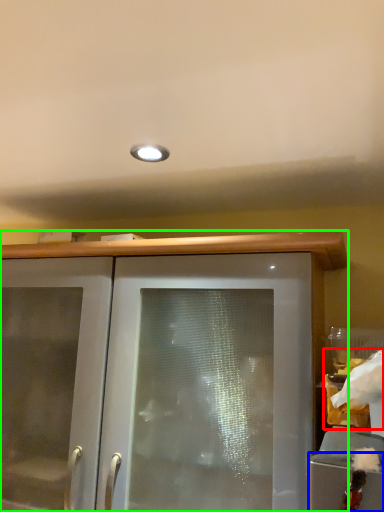
Question: Based on their relative distances, which object is nearer to food (highlighted by a red box)? Choose from cabinetry (highlighted by a blue box) and cabinetry (highlighted by a green box).

Choices:
 (A) cabinetry
 (B) cabinetry

Answer: (A)